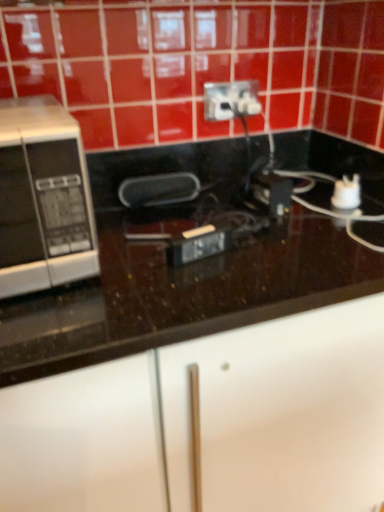
Question: Is white plastic power plugs and sockets at upper center situated inside silver/black microwave at left or outside?

Choices:
 (A) outside
 (B) inside

Answer: (A)

Question: From the image's perspective, is white plastic power plugs and sockets at upper center located above or below silver/black microwave at left?

Choices:
 (A) above
 (B) below

Answer: (A)

Question: Which is nearer to the black glossy countertop at center?

Choices:
 (A) white plastic power plugs and sockets at upper center
 (B) silver/black microwave at left

Answer: (B)

Question: Estimate the real-world distances between objects in this image. Which object is farther from the silver/black microwave at left?

Choices:
 (A) white plastic power plugs and sockets at upper center
 (B) black glossy countertop at center

Answer: (A)